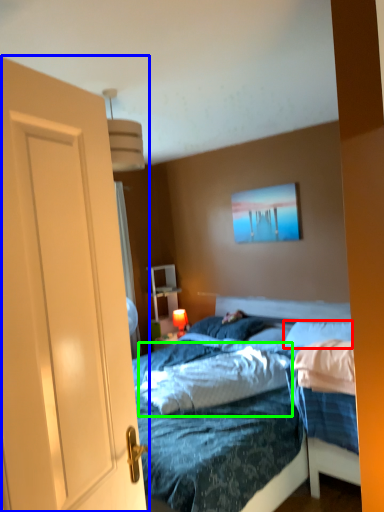
Question: Which is nearer to the pillow (highlighted by a red box)? door (highlighted by a blue box) or mattress (highlighted by a green box).

Choices:
 (A) door
 (B) mattress

Answer: (B)